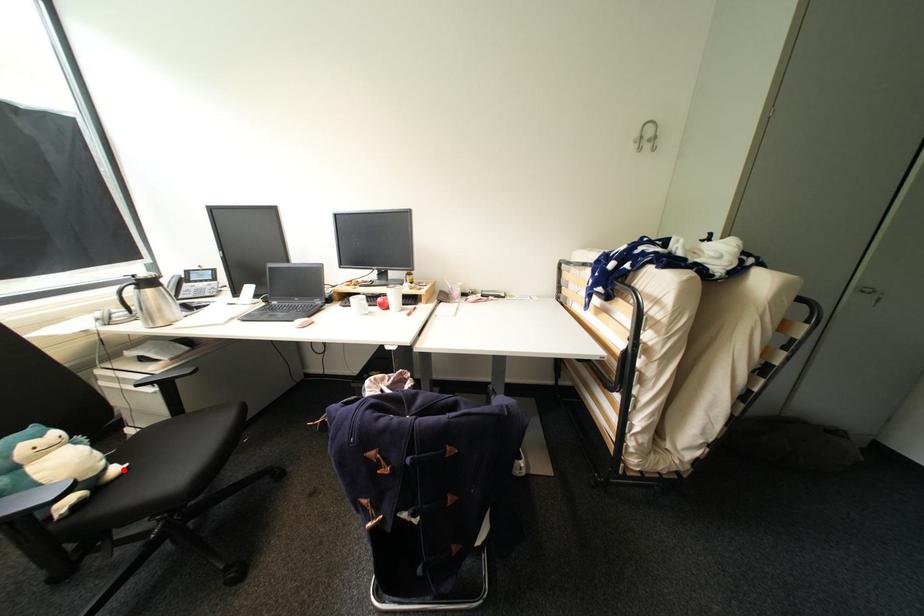
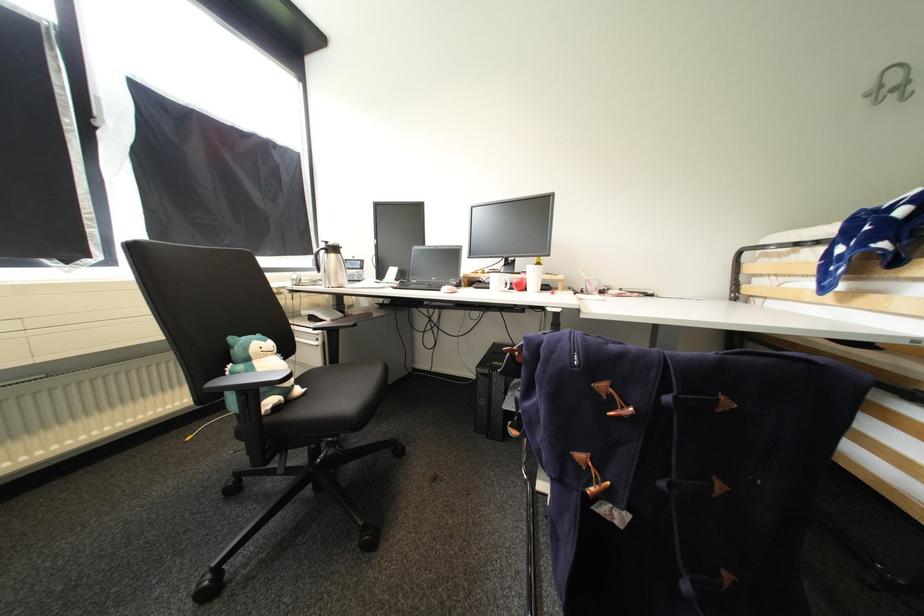
The point at the highlighted location is marked in the first image. Where is the corresponding point in the second image?

(306, 391)